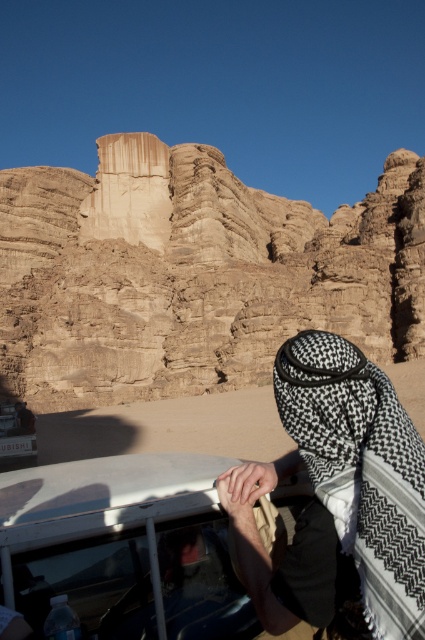
Can you confirm if black checkered headscarf at right is positioned below metallic silver car at lower left?

No.

How distant is black checkered headscarf at right from metallic silver car at lower left?

They are 35.74 meters apart.

Is point (302, 424) farther from viewer compared to point (5, 444)?

No, (302, 424) is in front of (5, 444).

Where is `black checkered headscarf at right`? The height and width of the screenshot is (640, 425). black checkered headscarf at right is located at coordinates (350, 483).

Is point (300, 308) farther from camera compared to point (370, 369)?

Yes, it is.

Is smooth sandstone rock formation at center smaller than black checkered headscarf at right?

Actually, smooth sandstone rock formation at center might be larger than black checkered headscarf at right.

You are a GUI agent. You are given a task and a screenshot of the screen. Output one action in this format:
    pyautogui.click(x=<x>, y=<y>)
    Task: Click on the smooth sandstone rock formation at center
    The width and height of the screenshot is (425, 640).
    Given the screenshot: What is the action you would take?
    pyautogui.click(x=192, y=273)

How far apart are smooth sandstone rock formation at center and metallic silver car at lower left?

They are 52.13 meters apart.

Is smooth sandstone rock formation at center above metallic silver car at lower left?

Yes, smooth sandstone rock formation at center is above metallic silver car at lower left.

Does point (408, 285) lie in front of point (5, 451)?

No, it is not.

This screenshot has width=425, height=640. Find the location of `smooth sandstone rock formation at center`. smooth sandstone rock formation at center is located at coordinates (192, 273).